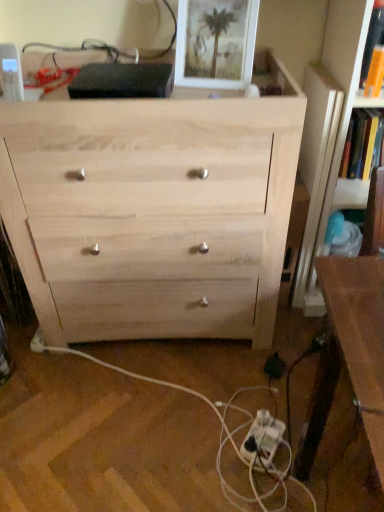
The width and height of the screenshot is (384, 512). In order to click on free spot above wooden floor at lower center (from a real-world perspective) in this screenshot , I will do `click(160, 404)`.